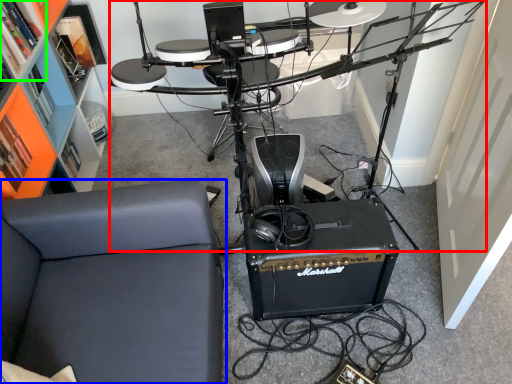
Question: Which object is the closest to the computer desk (highlighted by a red box)? Choose among these: furniture (highlighted by a blue box) or shelf (highlighted by a green box).

Choices:
 (A) furniture
 (B) shelf

Answer: (A)